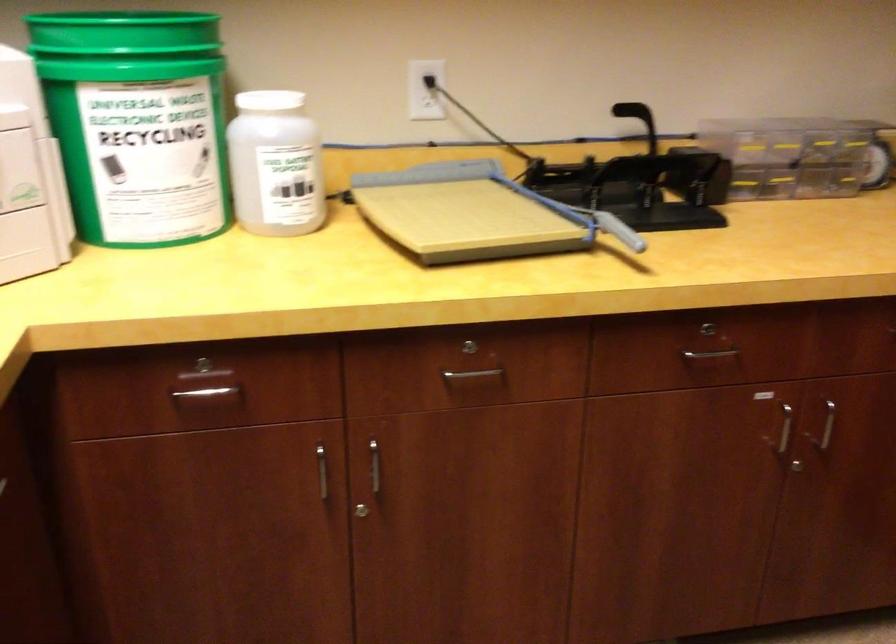
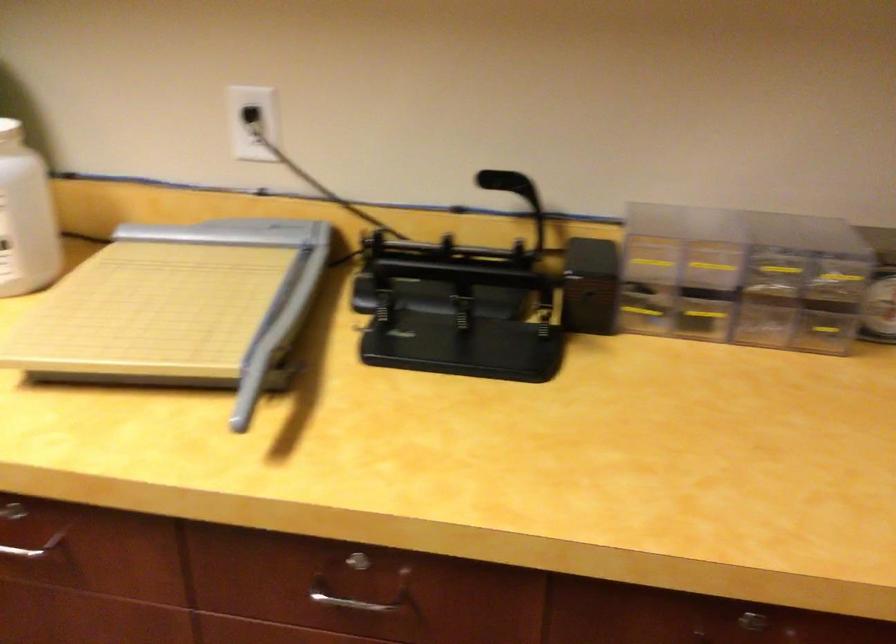
Where in the second image is the point corresponding to (x=471, y=384) from the first image?

(33, 547)